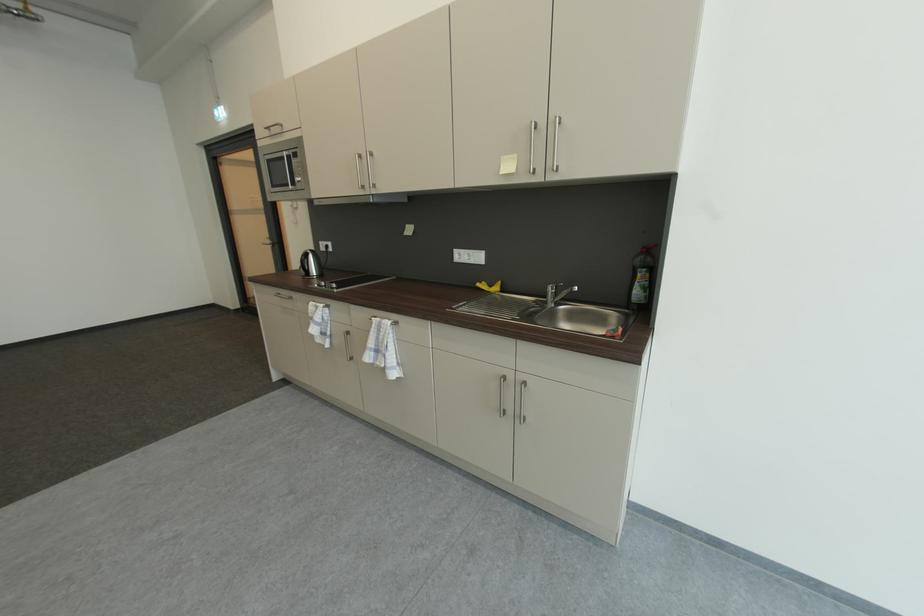
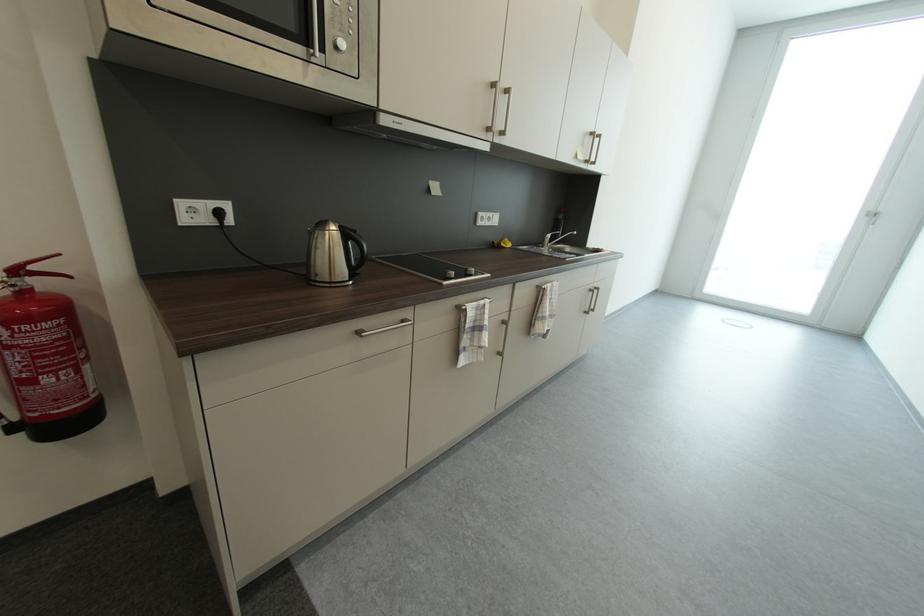
Where in the second image is the point corresponding to (506,175) from the first image?

(585, 160)